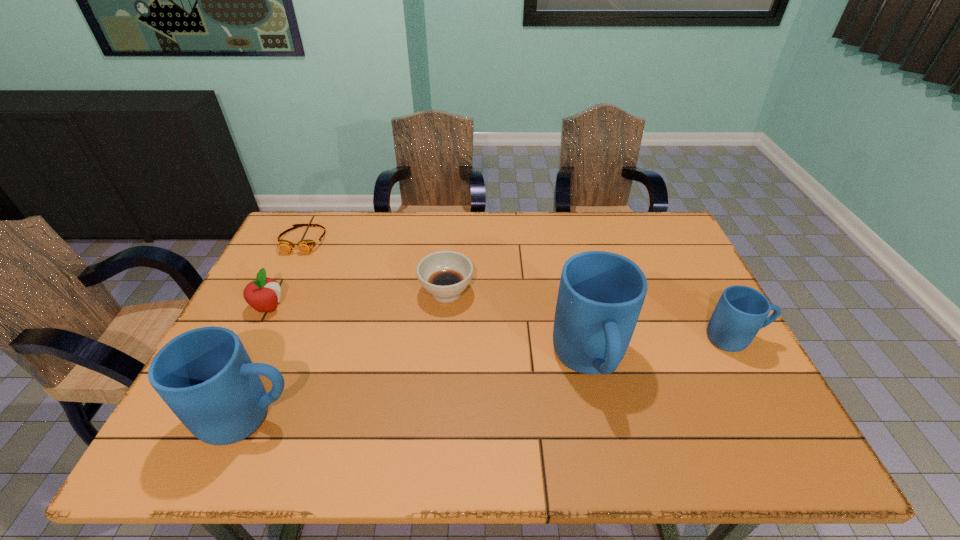
This screenshot has width=960, height=540. Find the location of `the second tallest mug`. the second tallest mug is located at coordinates (205, 376).

The height and width of the screenshot is (540, 960). Find the location of `the leftmost mug`. the leftmost mug is located at coordinates (205, 376).

Identify the location of the second mug from left to right. (601, 294).

The image size is (960, 540). Find the location of `the shortest mug`. the shortest mug is located at coordinates (741, 311).

The image size is (960, 540). I want to click on the third tallest object, so click(741, 311).

Locate an element on the screen. The width and height of the screenshot is (960, 540). the fourth object from left to right is located at coordinates (445, 275).

At what (x,y) coordinates should I click in order to perform the action: click on soup bowl. Please return your answer as a coordinate pair (x, y). Image resolution: width=960 pixels, height=540 pixels. Looking at the image, I should click on (445, 275).

I want to click on the farthest object, so pos(305,246).

Where is `goggles`? goggles is located at coordinates (305, 246).

This screenshot has width=960, height=540. Find the location of `apple`. apple is located at coordinates (263, 294).